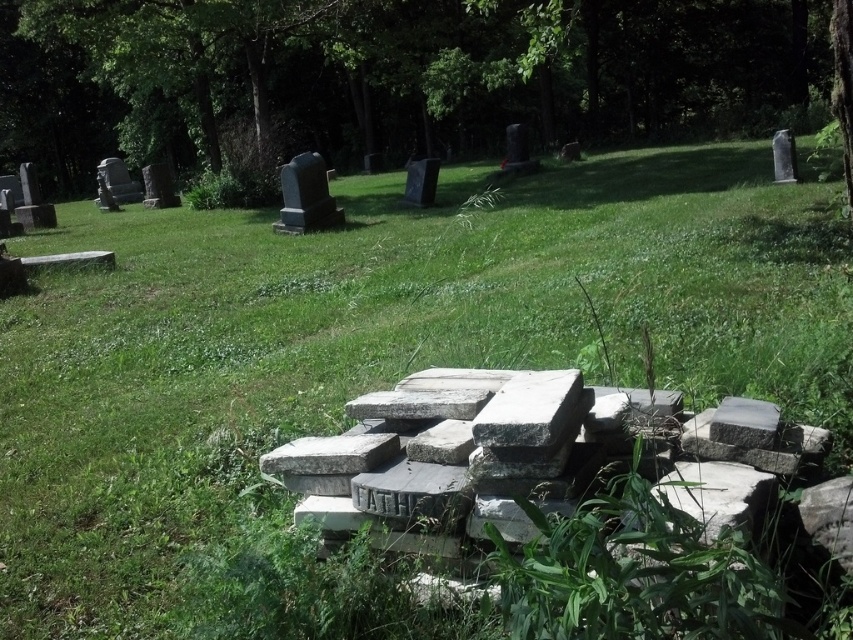
Is smooth gray stone at center positioned before smooth gray tombstone at upper left?

Yes, smooth gray stone at center is in front of smooth gray tombstone at upper left.

What do you see at coordinates (421, 180) in the screenshot? I see `smooth gray stone at center` at bounding box center [421, 180].

This screenshot has height=640, width=853. I want to click on smooth gray stone at center, so click(x=421, y=180).

You are a GUI agent. You are given a task and a screenshot of the screen. Output one action in this format:
    pyautogui.click(x=<x>, y=<y>)
    Task: Click on the smooth gray stone at center
    The height and width of the screenshot is (640, 853).
    Given the screenshot: What is the action you would take?
    pyautogui.click(x=421, y=180)

Does green leafy tree at upper center have a greater height compared to smooth gray stone at center?

Correct, green leafy tree at upper center is much taller as smooth gray stone at center.

Where is `green leafy tree at upper center`? This screenshot has width=853, height=640. green leafy tree at upper center is located at coordinates (393, 74).

The height and width of the screenshot is (640, 853). Describe the element at coordinates (393, 74) in the screenshot. I see `green leafy tree at upper center` at that location.

Can you confirm if green leafy tree at upper center is positioned to the right of smooth gray tombstone at upper left?

Indeed, green leafy tree at upper center is positioned on the right side of smooth gray tombstone at upper left.

Identify the location of green leafy tree at upper center. Image resolution: width=853 pixels, height=640 pixels. (393, 74).